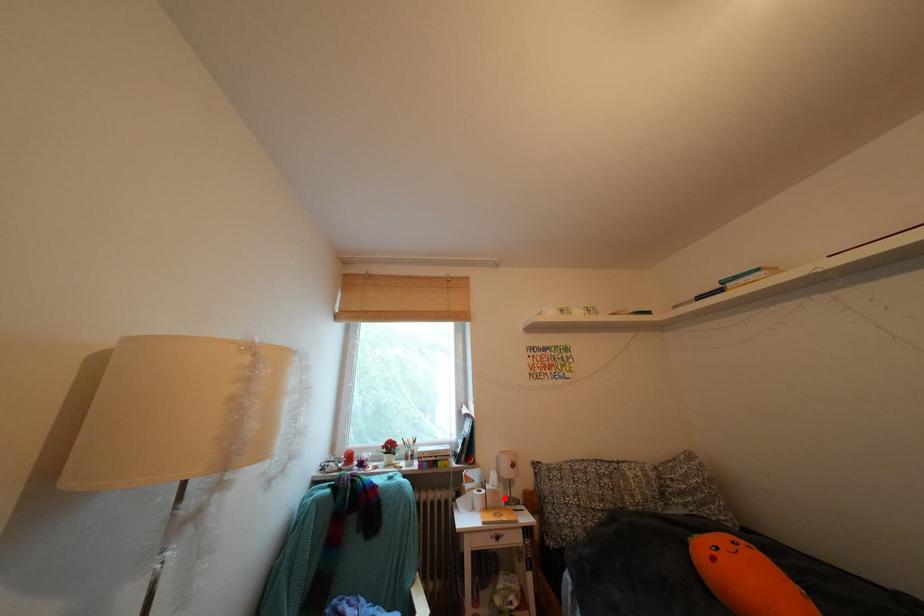
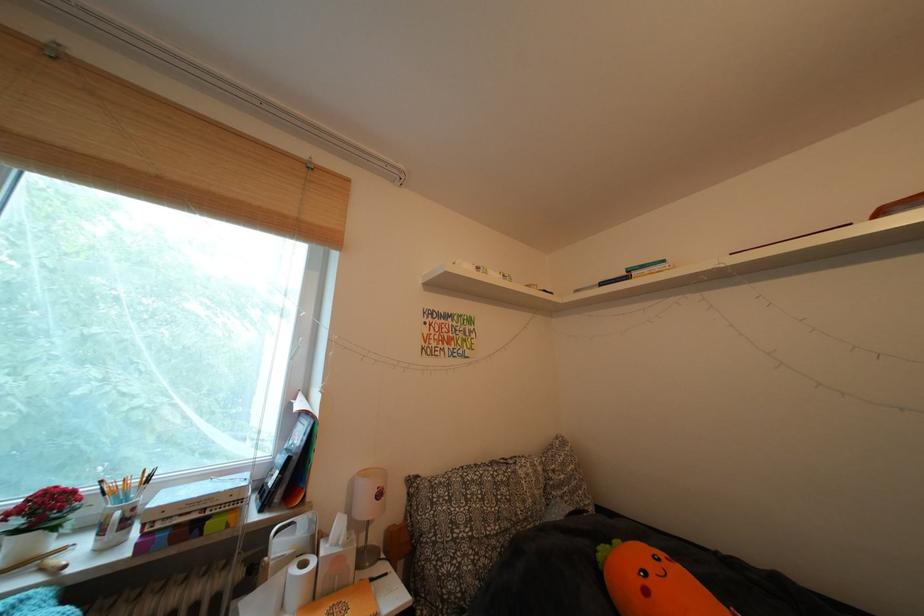
In the second image, find the point that corresponds to the highlighted location in the first image.

(346, 565)